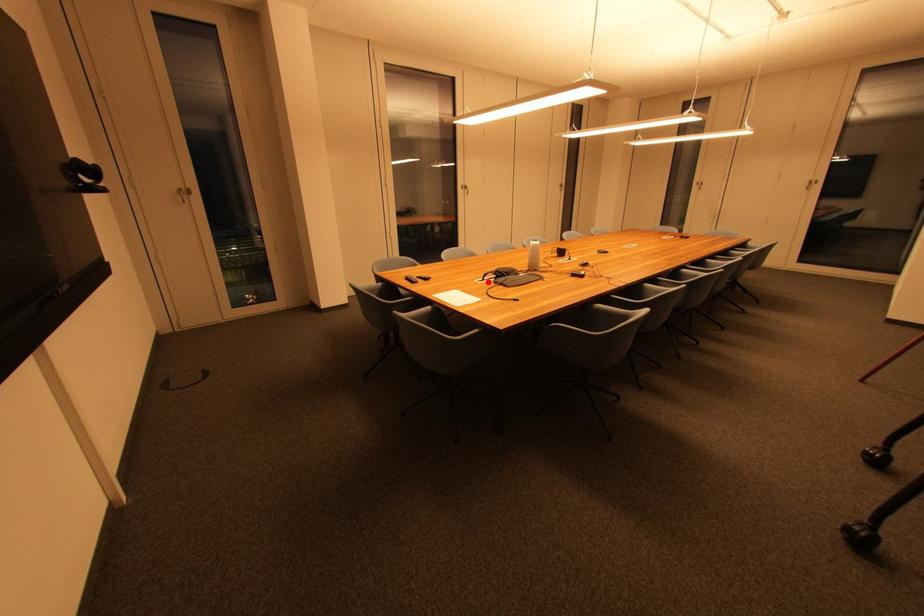
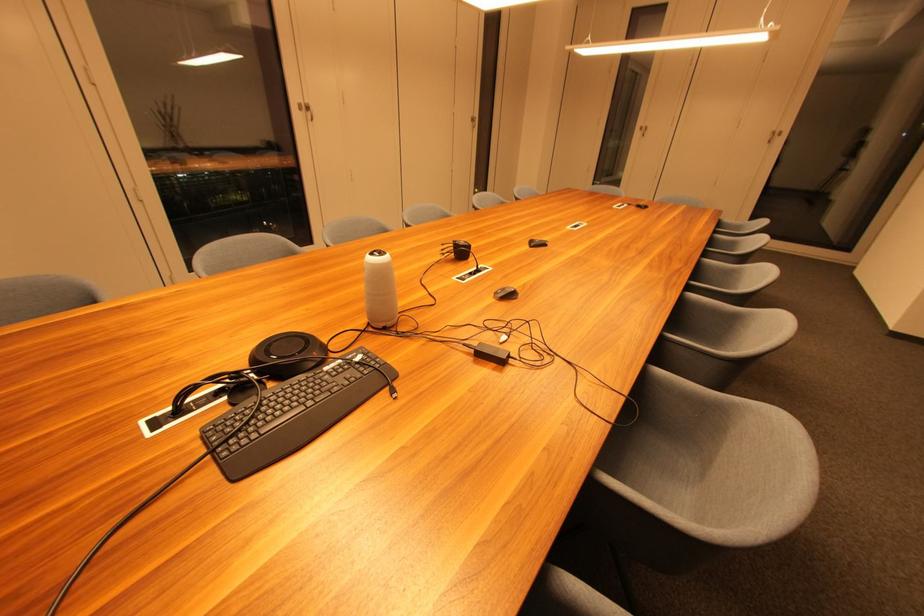
In the second image, find the point that corresponds to the highlighted location in the first image.

(185, 414)